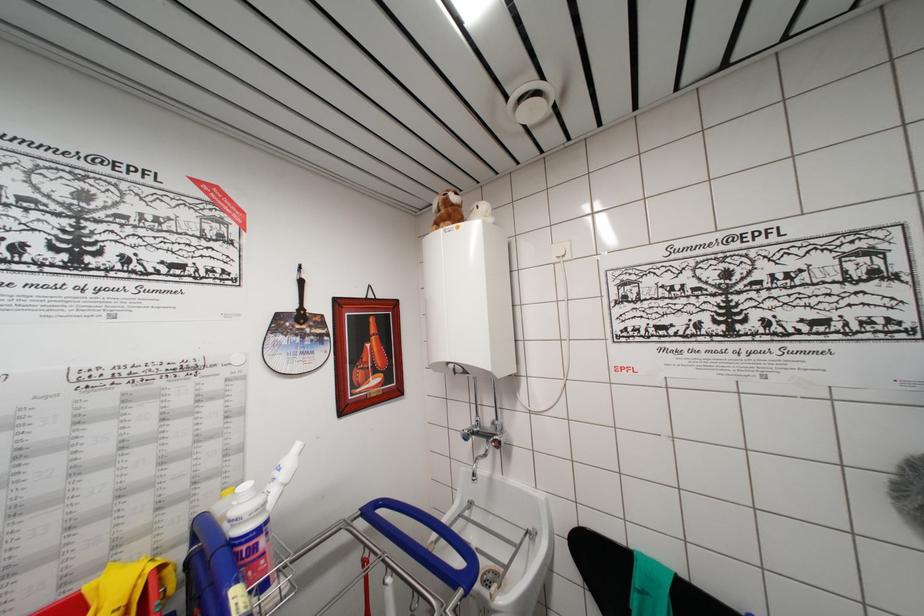
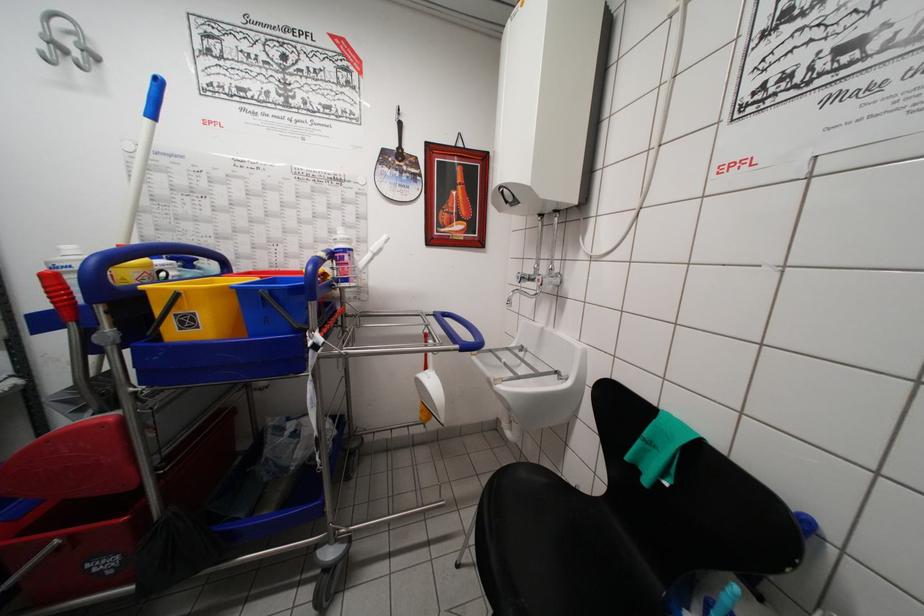
Where in the second image is the point corresponding to the point at 458,378 from the first image?

(511, 207)